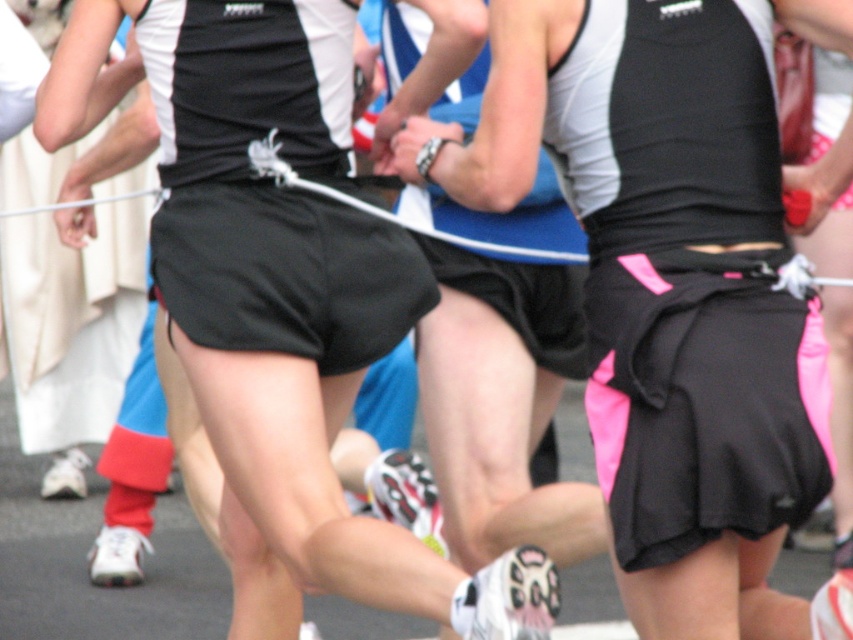
Question: Can you confirm if black matte shorts at center is positioned to the right of black matte skirt at center?

Choices:
 (A) yes
 (B) no

Answer: (B)

Question: Which point is closer to the camera taking this photo?

Choices:
 (A) (397, 252)
 (B) (799, 8)

Answer: (B)

Question: Is black matte shorts at center to the left of black matte skirt at center from the viewer's perspective?

Choices:
 (A) yes
 (B) no

Answer: (A)

Question: Is black matte shorts at center thinner than black matte skirt at center?

Choices:
 (A) yes
 (B) no

Answer: (B)

Question: Which point is farther to the camera?

Choices:
 (A) black matte shorts at center
 (B) black matte skirt at center

Answer: (B)

Question: Among these points, which one is farthest from the camera?

Choices:
 (A) (561, 1)
 (B) (276, 10)

Answer: (B)